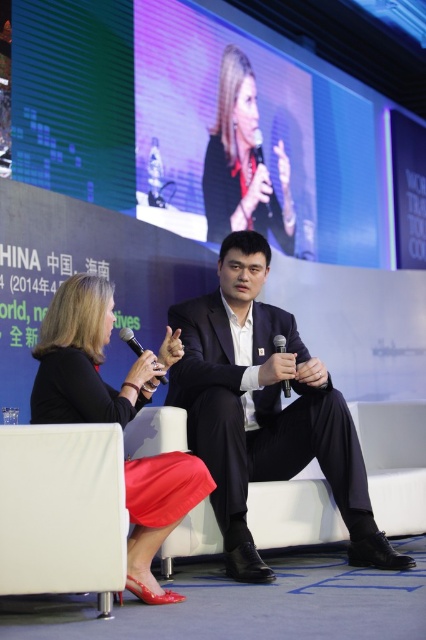
You are organizing a small event and need to seat two guests who require chairs of equal width. You have the white fabric chair at lower left and the white fabric chair at lower right available. Based on the image, can you determine if these two chairs are the same width?

The white fabric chair at lower left is narrower than the white fabric chair at lower right, so they are not the same width.